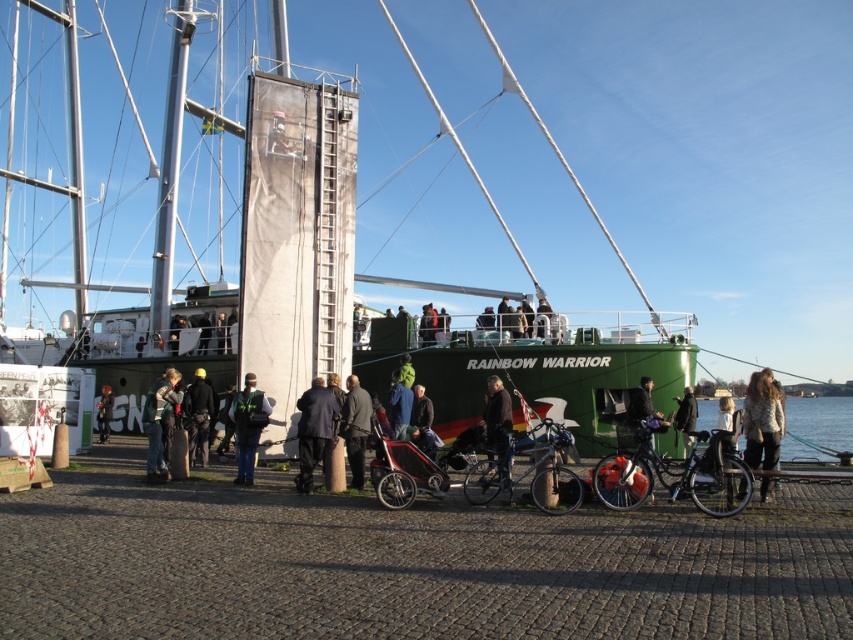
In the scene shown: You are standing at point (357, 392) and want to walk to the marina entrance located at point (761, 406). Which direction should you walk to reach the entrance?

You should walk forward because point (761, 406) is in front of point (357, 392).

You are a photographer at the marina and want to capture both the white textured jacket at lower right and the dark gray jacket at center in a single shot. Which jacket will appear larger in the photo?

The white textured jacket at lower right will appear larger in the photo because it is taller than the dark gray jacket at center.